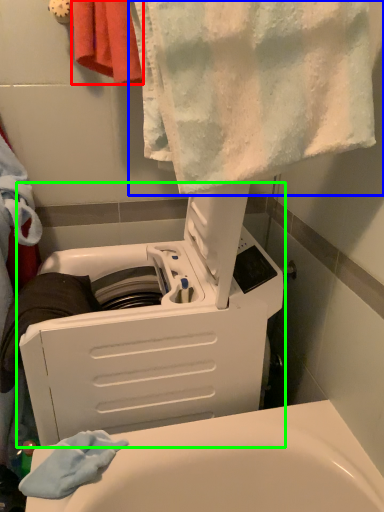
Question: Which object is the closest to the towel (highlighted by a red box)? Choose among these: towel (highlighted by a blue box) or appliance (highlighted by a green box).

Choices:
 (A) towel
 (B) appliance

Answer: (A)